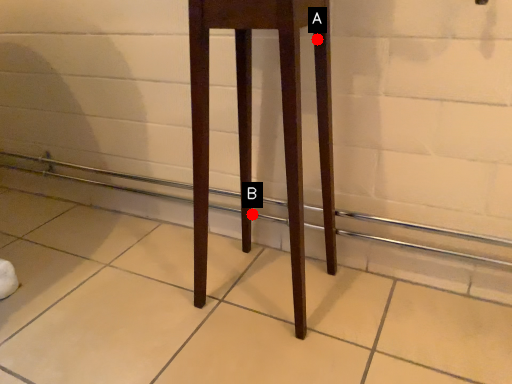
Question: Two points are circled on the image, labeled by A and B beside each circle. Among these points, which one is nearest to the camera?

Choices:
 (A) A is closer
 (B) B is closer

Answer: (A)